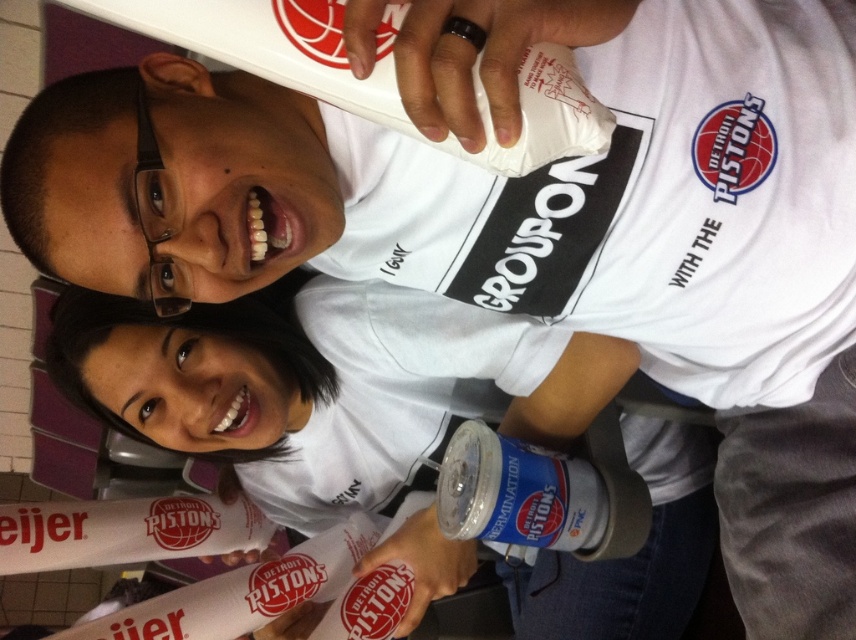
Question: Which of the following is the farthest from the observer?

Choices:
 (A) (322, 429)
 (B) (586, 481)

Answer: (A)

Question: Is white matte t-shirt at center bigger than blue metallic can at center?

Choices:
 (A) yes
 (B) no

Answer: (A)

Question: Considering the relative positions of white matte t-shirt at center and blue metallic can at center in the image provided, where is white matte t-shirt at center located with respect to blue metallic can at center?

Choices:
 (A) below
 (B) above

Answer: (A)

Question: Which point is closer to the camera?

Choices:
 (A) blue metallic can at center
 (B) white matte t-shirt at center

Answer: (A)

Question: Does white matte t-shirt at center have a larger size compared to blue metallic can at center?

Choices:
 (A) no
 (B) yes

Answer: (B)